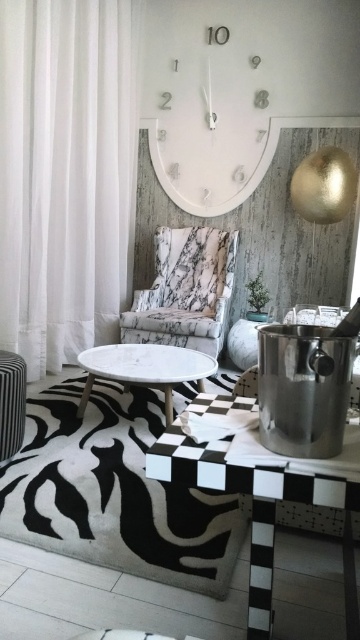
Question: Does marble-patterned armchair at center have a greater width compared to white marble side table at center?

Choices:
 (A) yes
 (B) no

Answer: (A)

Question: Can you confirm if white glossy clock at upper center is positioned to the right of black and white checkered table at lower center?

Choices:
 (A) no
 (B) yes

Answer: (A)

Question: Among these points, which one is nearest to the camera?

Choices:
 (A) (174, 8)
 (B) (6, 442)
 (C) (204, 316)

Answer: (B)

Question: Which point is closer to the camera taking this photo?

Choices:
 (A) (196, 51)
 (B) (198, 320)
 (C) (20, 445)
 (D) (92, 369)

Answer: (C)

Question: Does black and white checkered table at lower center come in front of white marble side table at center?

Choices:
 (A) no
 (B) yes

Answer: (B)

Question: Among these points, which one is farthest from the camera?

Choices:
 (A) (342, 481)
 (B) (212, 250)

Answer: (B)